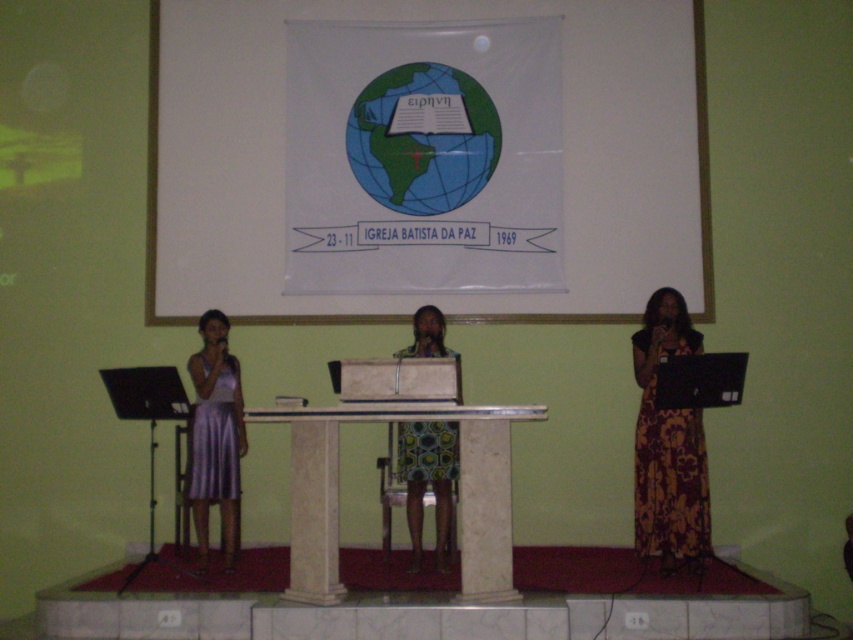
Is white fabric at center above white marble table at center?

Correct, white fabric at center is located above white marble table at center.

Is white fabric at center wider than white marble table at center?

Yes, white fabric at center is wider than white marble table at center.

Is point (651, 134) positioned before point (316, 545)?

No, it is behind (316, 545).

Identify the location of white fabric at center. This screenshot has width=853, height=640. (425, 294).

In the scene shown: Between white fabric at center and printed fabric dress at center, which one has less height?

printed fabric dress at center is shorter.

Does white fabric at center have a lesser width compared to printed fabric dress at center?

In fact, white fabric at center might be wider than printed fabric dress at center.

Between point (634, 138) and point (421, 541), which one is positioned behind?

Point (634, 138)

Identify the location of white fabric at center. (425, 294).

Identify the location of white marble table at center. (459, 492).